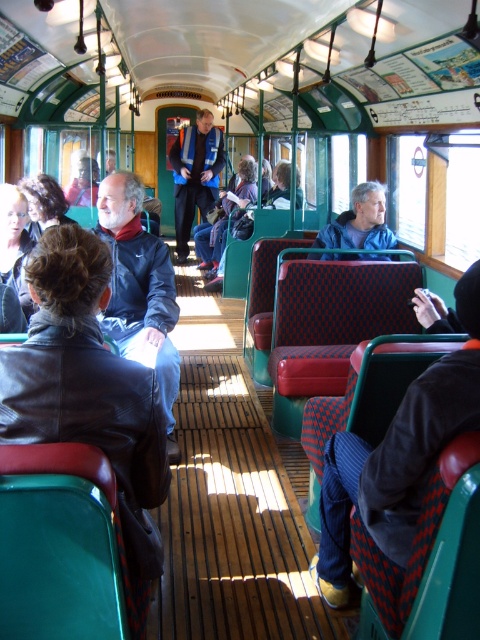
Question: Which point appears farthest from the camera in this image?

Choices:
 (A) (179, 182)
 (B) (154, 337)
 (C) (328, 598)

Answer: (A)

Question: Does dark blue corduroy pants at center appear under blue matte jacket at center?

Choices:
 (A) yes
 (B) no

Answer: (A)

Question: Which object is farther from the camera taking this photo?

Choices:
 (A) dark blue corduroy pants at center
 (B) reflective silver coach at center
 (C) blue matte jacket at center

Answer: (B)

Question: Which point is farther to the camera?

Choices:
 (A) matte black jacket at left
 (B) reflective silver coach at center

Answer: (B)

Question: Does reflective silver coach at center appear under blue matte jacket at center?

Choices:
 (A) yes
 (B) no

Answer: (B)

Question: Is dark blue corduroy pants at center behind reflective silver coach at center?

Choices:
 (A) yes
 (B) no

Answer: (B)